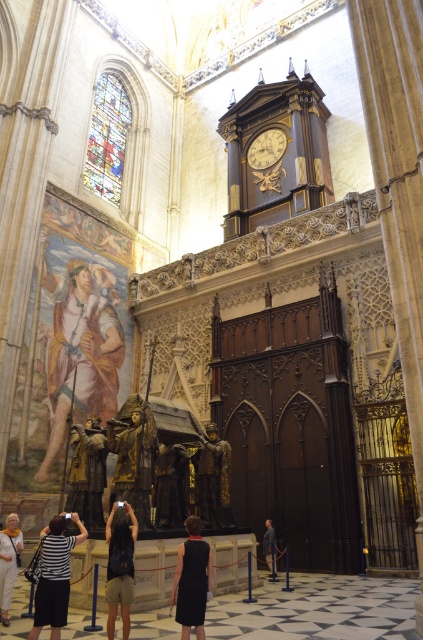
Question: Is matte gold statue at center further to the viewer compared to gold polished statue at center?

Choices:
 (A) no
 (B) yes

Answer: (B)

Question: Observing the image, what is the correct spatial positioning of dark brown leather jacket at center in reference to black leather jacket at center?

Choices:
 (A) right
 (B) left

Answer: (B)

Question: Which is nearer to the black leather jacket at center?

Choices:
 (A) gold textured statue at center
 (B) wooden clock at upper center
 (C) gold polished statue at center
 (D) gold leaf statue at center

Answer: (C)

Question: Does gold polished statue at center lie behind dark brown leather jacket at center?

Choices:
 (A) no
 (B) yes

Answer: (B)

Question: Which is farther from the striped fabric dress at lower left?

Choices:
 (A) black satin dress at center
 (B) white cotton dress at lower left
 (C) gold polished statue at center
 (D) matte gold statue at center

Answer: (D)

Question: Among these objects, which one is farthest from the camera?

Choices:
 (A) gold leaf statue at center
 (B) polished bronze statue at center

Answer: (B)